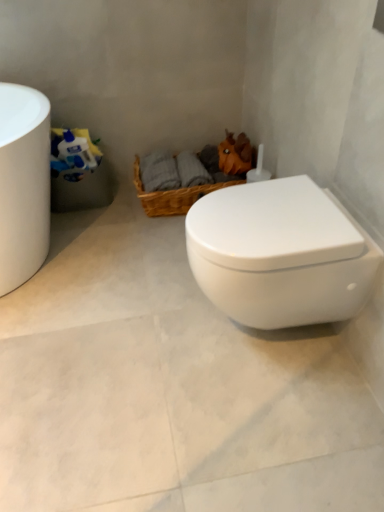
Identify the location of free space above white glossy toilet at center (from a real-world perspective). (269, 210).